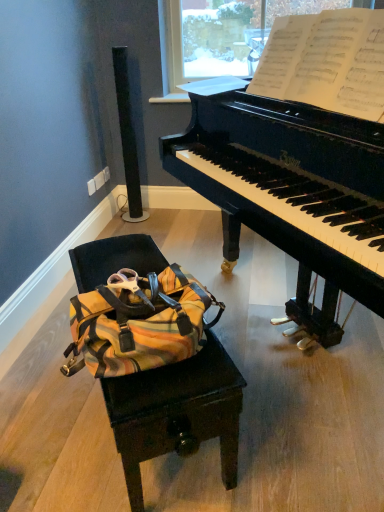
The height and width of the screenshot is (512, 384). What are the coordinates of `leather-like black table at lower left` in the screenshot? It's located at (176, 413).

Image resolution: width=384 pixels, height=512 pixels. What do you see at coordinates (176, 413) in the screenshot? I see `leather-like black table at lower left` at bounding box center [176, 413].

Identify the location of leather-like black table at lower left. The width and height of the screenshot is (384, 512). (176, 413).